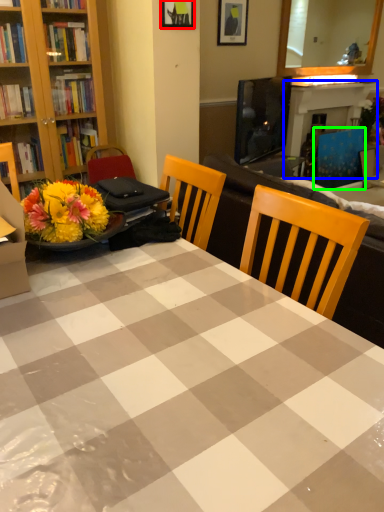
Question: Which object is the farthest from picture frame (highlighted by a red box)? Choose among these: fireplace (highlighted by a blue box) or armchair (highlighted by a green box).

Choices:
 (A) fireplace
 (B) armchair

Answer: (B)